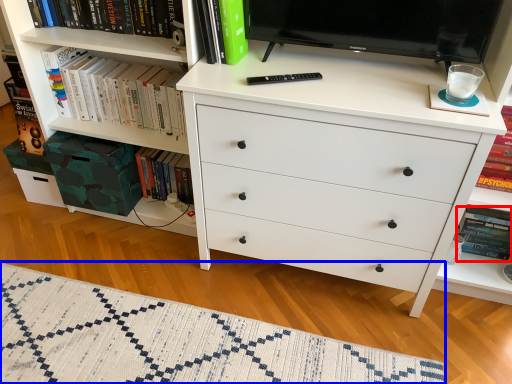
Question: Which object is closer to the camera taking this photo, paperback book (highlighted by a red box) or blanket (highlighted by a blue box)?

Choices:
 (A) paperback book
 (B) blanket

Answer: (B)